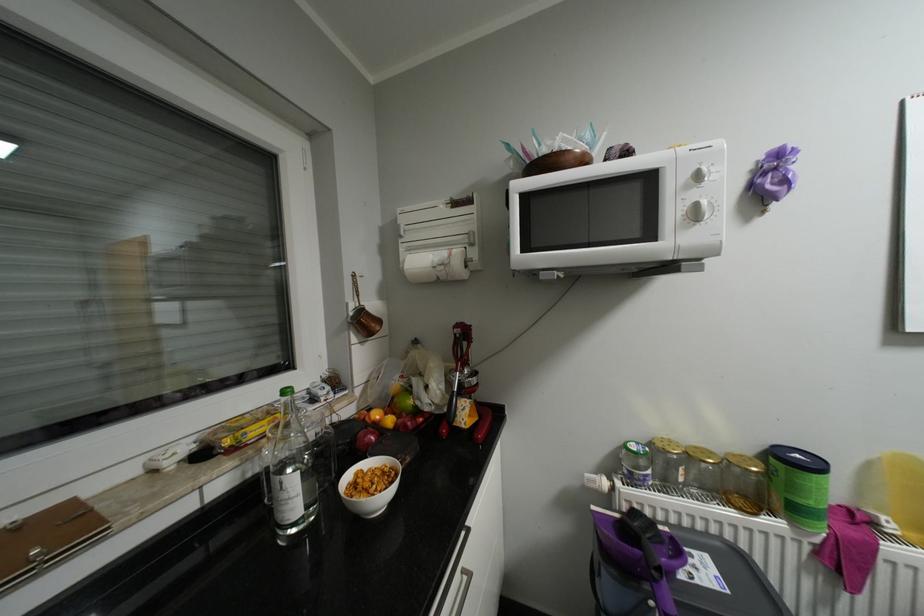
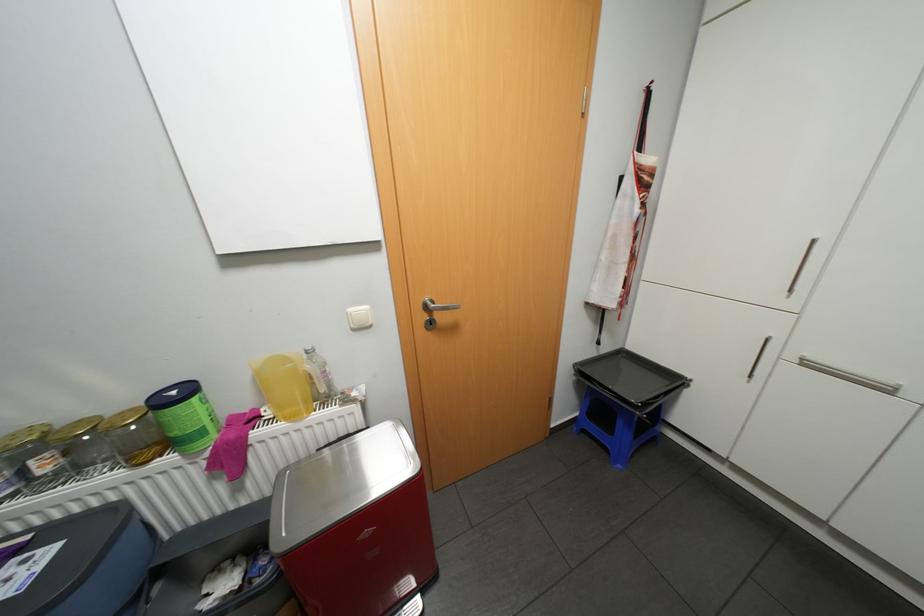
Locate, in the second image, the point that corresponds to point (703, 447) in the first image.

(88, 419)